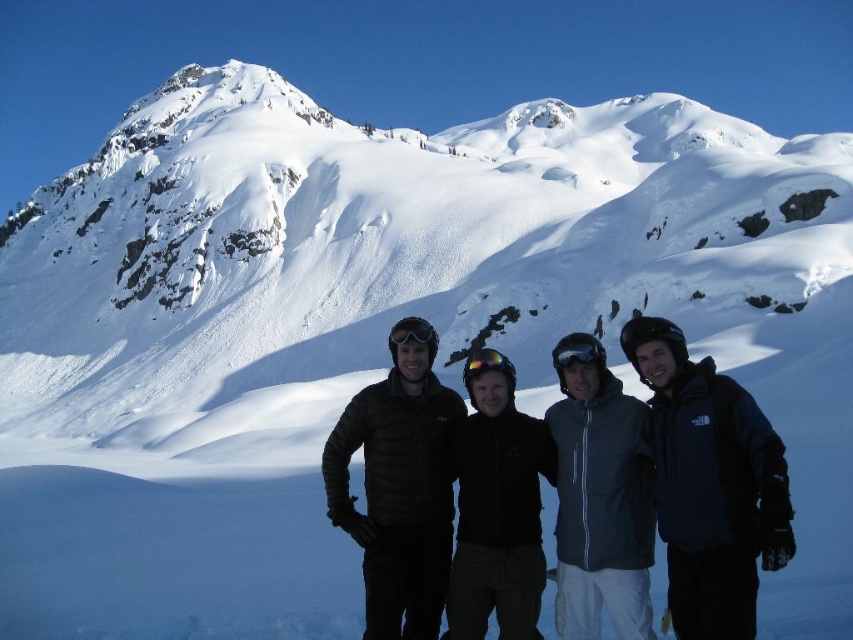
From the picture: Measure the distance between black puffer jacket at center and matte black goggles at center.

black puffer jacket at center and matte black goggles at center are 8.62 meters apart.

Can you confirm if black puffer jacket at center is taller than matte black goggles at center?

Yes, black puffer jacket at center is taller than matte black goggles at center.

Measure the distance between black puffer jacket at center and camera.

black puffer jacket at center and camera are 40.40 meters apart.

Locate an element on the screen. The image size is (853, 640). black puffer jacket at center is located at coordinates (399, 492).

Between point (526, 429) and point (402, 323), which one is positioned behind?

The point (402, 323) is more distant.

Does black softshell jacket at center have a lesser height compared to matte black goggles at center?

In fact, black softshell jacket at center may be taller than matte black goggles at center.

Between point (537, 524) and point (405, 317), which one is positioned behind?

Positioned behind is point (405, 317).

The height and width of the screenshot is (640, 853). I want to click on black softshell jacket at center, so click(x=498, y=515).

Does black softshell jacket at center have a larger size compared to black matte goggles at center?

No, black softshell jacket at center is not bigger than black matte goggles at center.

Between black softshell jacket at center and black matte goggles at center, which one appears on the left side from the viewer's perspective?

From the viewer's perspective, black softshell jacket at center appears more on the left side.

Locate an element on the screen. black softshell jacket at center is located at coordinates (498, 515).

Identify the location of black softshell jacket at center. (498, 515).